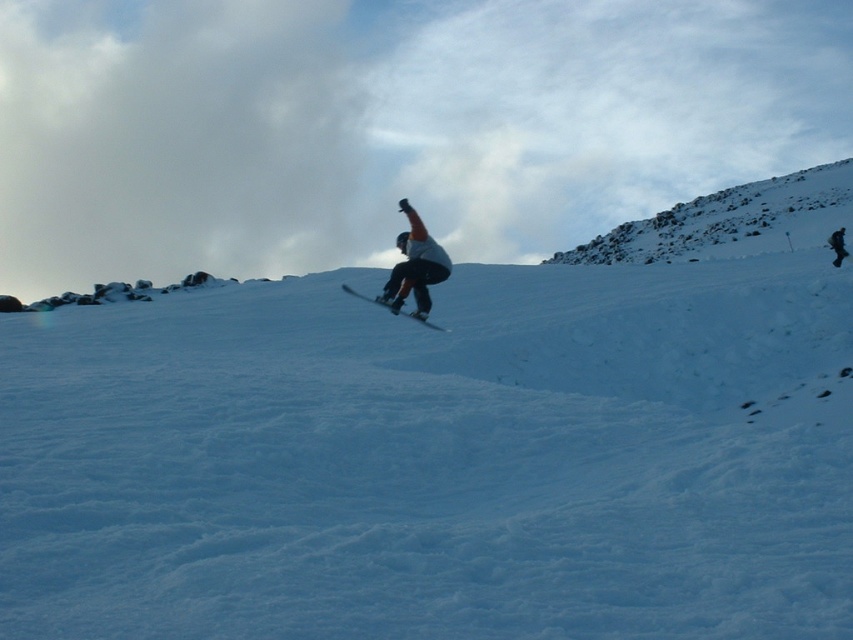
From the picture: Can you confirm if snowy rocky hill at upper right is taller than matte gray snowboarder at center?

Yes, snowy rocky hill at upper right is taller than matte gray snowboarder at center.

Does snowy rocky hill at upper right have a larger size compared to matte gray snowboarder at center?

Indeed, snowy rocky hill at upper right has a larger size compared to matte gray snowboarder at center.

Does point (708, 211) lie in front of point (418, 220)?

No.

The height and width of the screenshot is (640, 853). I want to click on snowy rocky hill at upper right, so click(730, 221).

Between matte gray snowboarder at center and matte black snowboard at center, which one appears on the left side from the viewer's perspective?

From the viewer's perspective, matte black snowboard at center appears more on the left side.

Identify the location of matte gray snowboarder at center. Image resolution: width=853 pixels, height=640 pixels. (412, 269).

Can you confirm if white powdery snow at center is wider than matte black snowboard at center?

Yes, white powdery snow at center is wider than matte black snowboard at center.

Between white powdery snow at center and matte black snowboard at center, which one appears on the left side from the viewer's perspective?

matte black snowboard at center

Between point (421, 380) and point (373, 298), which one is positioned in front?

Positioned in front is point (421, 380).

I want to click on white powdery snow at center, so click(x=448, y=449).